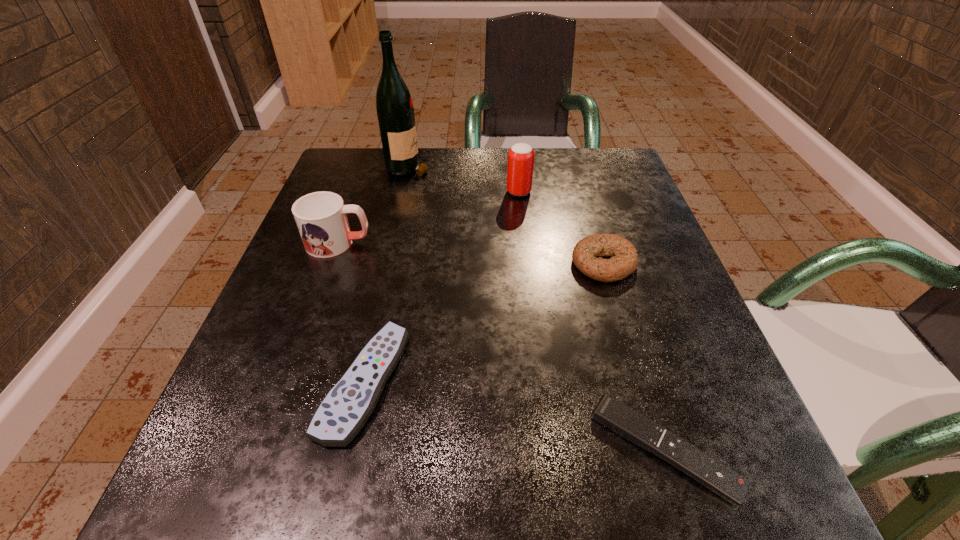
At what (x,y) coordinates should I click in order to perform the action: click on wine bottle. Please return your answer as a coordinate pair (x, y). The height and width of the screenshot is (540, 960). Looking at the image, I should click on (395, 111).

Where is `the farthest object`? the farthest object is located at coordinates (395, 111).

Locate an element on the screen. This screenshot has width=960, height=540. beer can is located at coordinates (520, 166).

At what (x,y) coordinates should I click in order to perform the action: click on the fifth nearest object. Please return your answer as a coordinate pair (x, y). Looking at the image, I should click on [x=520, y=166].

Where is `mug`? mug is located at coordinates (321, 217).

Identify the location of bagel. (624, 259).

This screenshot has height=540, width=960. Identify the location of the left remote control. (345, 409).

Find the location of a particular element. the fifth tallest object is located at coordinates (345, 409).

Where is `the right remote control`? the right remote control is located at coordinates (630, 424).

Where is `the shortest object`? Image resolution: width=960 pixels, height=540 pixels. the shortest object is located at coordinates (630, 424).